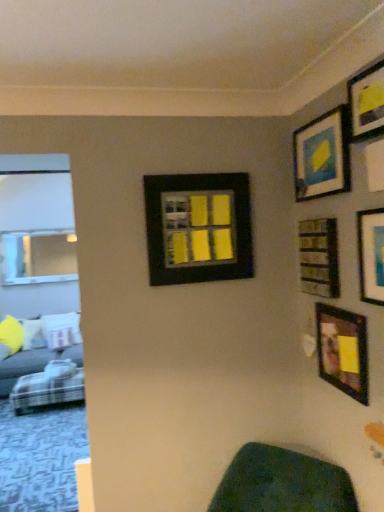
Question: Do you think wooden frame at lower right, the 4th picture frame when ordered from left to right, is within plaid fabric couch at lower left, or outside of it?

Choices:
 (A) outside
 (B) inside

Answer: (A)

Question: Relative to plaid fabric couch at lower left, is wooden frame at lower right, the 4th picture frame when ordered from left to right, in front or behind?

Choices:
 (A) behind
 (B) front

Answer: (B)

Question: Which is farther from the plush fabric couch at left?

Choices:
 (A) wooden frame at lower right, the 3th picture frame viewed from the right
 (B) wooden frame at upper right, which is the fourth picture frame in right-to-left order
 (C) matte black picture frame at upper right, which appears as the second picture frame when viewed from the right
 (D) matte black picture frame at upper right, the 5th picture frame in the right-to-left sequence
 (E) matte black picture frame at upper right, which is the 6th picture frame in left-to-right order

Answer: (C)

Question: Estimate the real-world distances between objects in this image. Which object is closer to the matte black picture frame at upper right, which appears as the second picture frame when viewed from the right?

Choices:
 (A) plush fabric couch at left
 (B) black matte picture frame at center, which is counted as the sixth picture frame, starting from the right
 (C) wooden frame at upper right, which ranks as the third picture frame in left-to-right order
 (D) matte black picture frame at upper right, which is the 6th picture frame in left-to-right order
 (E) matte black picture frame at upper right, which is counted as the second picture frame, starting from the left

Answer: (E)